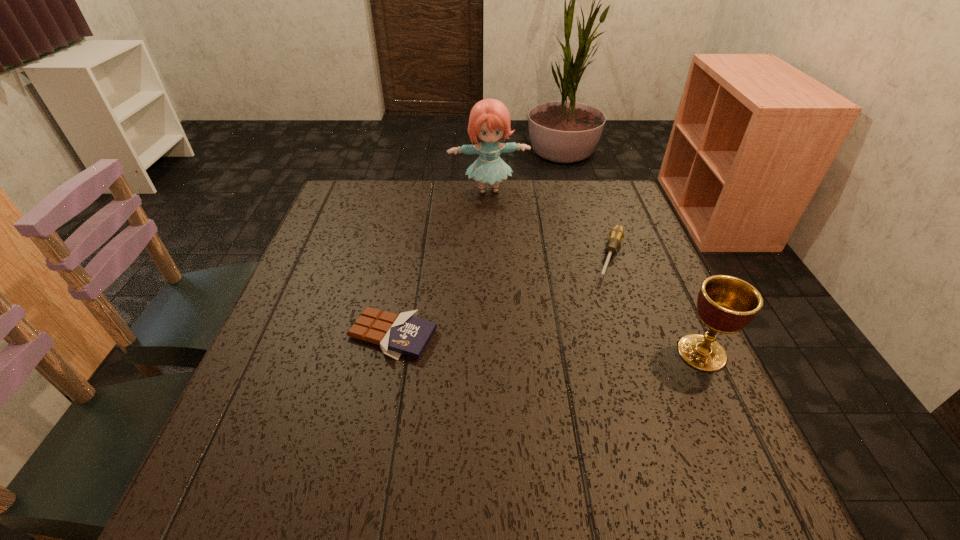
The height and width of the screenshot is (540, 960). Identify the location of vacant spot on the desktop that is between the shortest object and the rightmost object and is positioned at the tip of the second farthest object. click(580, 346).

This screenshot has width=960, height=540. I want to click on vacant space on the desktop that is between the shortest object and the third shortest object and is positioned on the front-facing side of the doll, so click(525, 342).